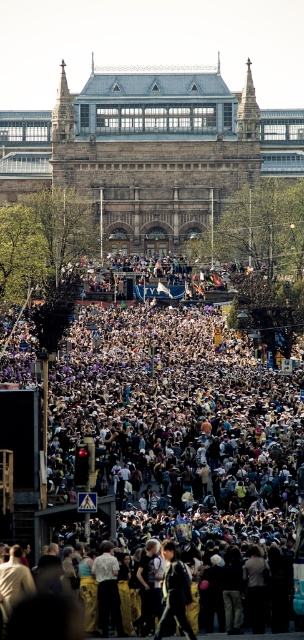
Describe the element at coordinates (169, 436) in the screenshot. I see `white cotton crowd at center` at that location.

Looking at this image, who is more forward, (252, 433) or (186, 577)?

Point (186, 577)

Find the location of a particular element. The image size is (304, 640). white cotton crowd at center is located at coordinates (169, 436).